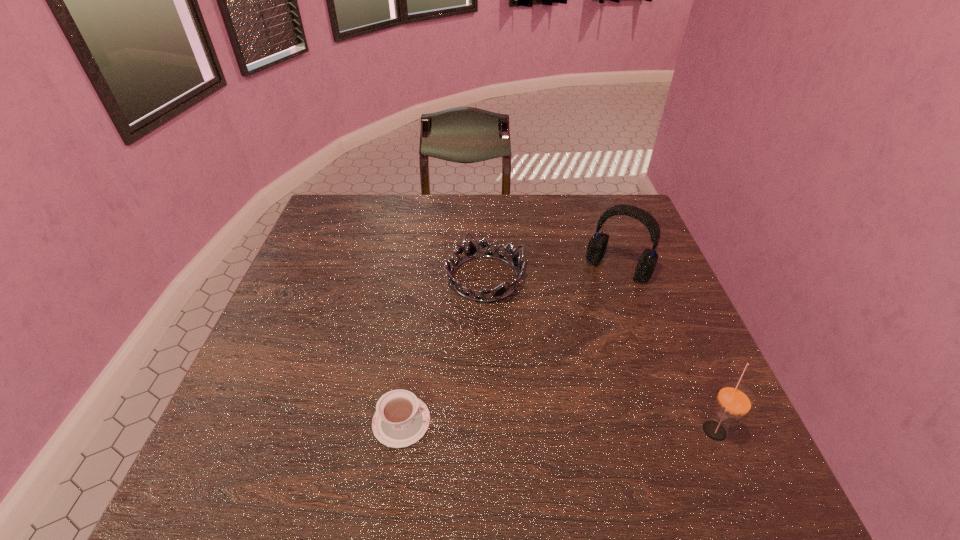
The image size is (960, 540). What are the coordinates of `vacant spot on the desktop that is between the shortest object and the straw and is positioned on the headband of the headset` in the screenshot? It's located at (513, 424).

At what (x,y) coordinates should I click in order to perform the action: click on vacant space on the desktop that is between the shortest object and the straw and is positioned on the front-facing side of the third tallest object. Please return your answer as a coordinate pair (x, y). This screenshot has width=960, height=540. Looking at the image, I should click on (587, 426).